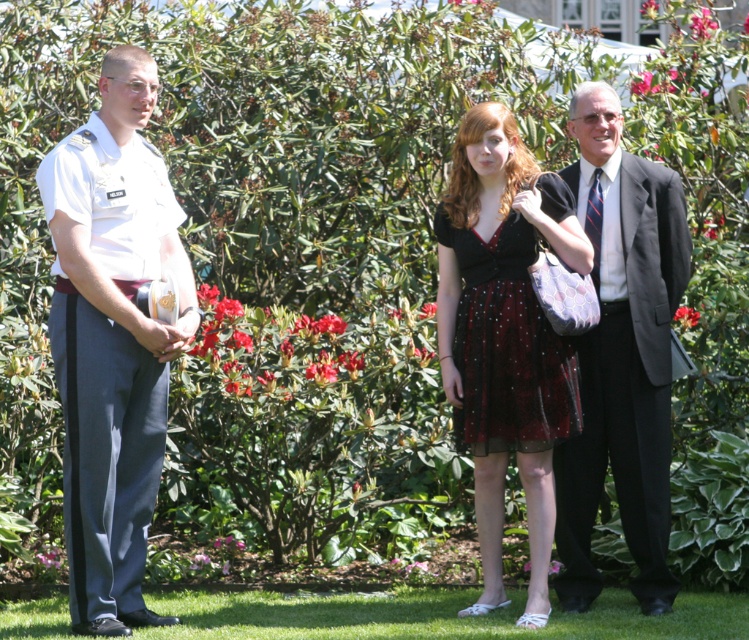
Question: Is white uniform at left wider than velvet dress at center?

Choices:
 (A) no
 (B) yes

Answer: (A)

Question: Which point appears farthest from the camera in this image?

Choices:
 (A) (524, 147)
 (B) (613, 108)
 (C) (524, 301)

Answer: (A)

Question: Does white uniform at left appear on the right side of black sheer dress at center?

Choices:
 (A) no
 (B) yes

Answer: (A)

Question: Estimate the real-world distances between objects in this image. Which object is closer to the black sheer dress at center?

Choices:
 (A) velvet dress at center
 (B) white uniform at left

Answer: (A)

Question: Which point is closer to the camera?

Choices:
 (A) (560, 532)
 (B) (512, 369)

Answer: (B)

Question: Is velvet dress at center wider than dark gray suit at center?

Choices:
 (A) yes
 (B) no

Answer: (A)